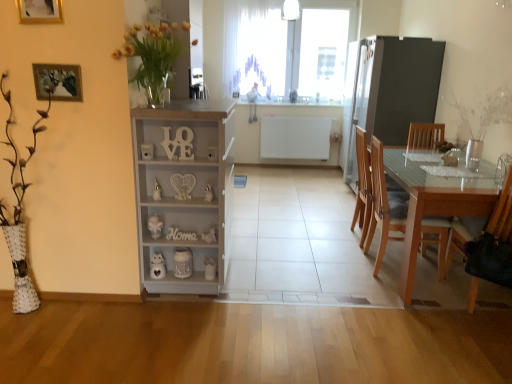
Question: From the image's perspective, is gold wooden picture frame at upper left, which is the 2th picture frame from bottom to top, positioned above or below white matte radiator at center, acting as the 1th appliance starting from the left?

Choices:
 (A) above
 (B) below

Answer: (A)

Question: Is gold wooden picture frame at upper left, which is the 2th picture frame from bottom to top, spatially inside white matte radiator at center, which is the first appliance from back to front, or outside of it?

Choices:
 (A) inside
 (B) outside

Answer: (B)

Question: Which is nearer to the light brown wood chair at right, placed as the third chair when sorted from front to back?

Choices:
 (A) clear glass vase at center
 (B) transparent glass window at upper center
 (C) yellow glass vase at upper left
 (D) white matte radiator at center, which is the first appliance from back to front
 (E) satin silver refrigerator at right, the 1th appliance from the front

Answer: (E)

Question: Considering the real-world distances, which object is farthest from the white painted wood cabinet at center?

Choices:
 (A) wooden chair at right, which appears as the 1th chair when viewed from the front
 (B) transparent glass window at upper center
 (C) light brown wood chair at right, acting as the 1th chair starting from the back
 (D) transparent glass table at right
 (E) yellow glass vase at upper left

Answer: (B)